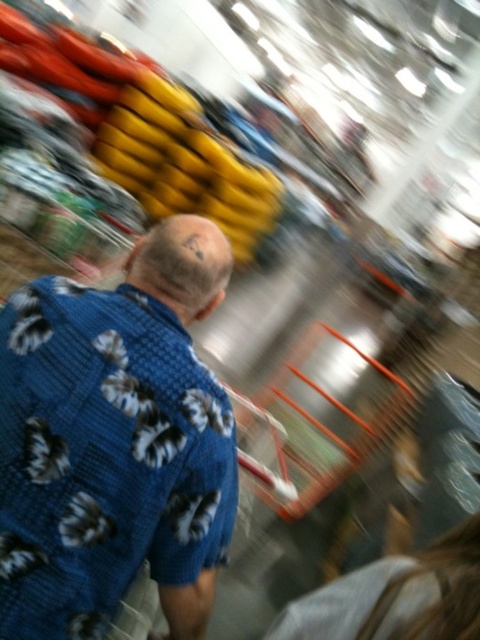
You are an observer in the scene. You notice the blue floral shirt at center and the blonde hair at lower right. Which object is positioned to the right side of the other?

The blue floral shirt at center is to the left of blonde hair at lower right, so the blonde hair at lower right is positioned to the right side of the blue floral shirt at center.

You are a security camera monitoring the store and you see the blue floral shirt at center and the blonde hair at lower right. Which one is closer to you?

The blue floral shirt at center is closer to you because it is further to the viewer than the blonde hair at lower right.